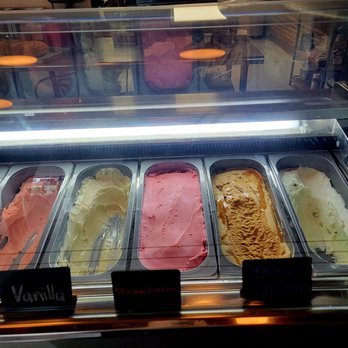
The width and height of the screenshot is (348, 348). Find the location of `edge of glass display case`. edge of glass display case is located at coordinates (44, 10), (131, 5), (209, 2).